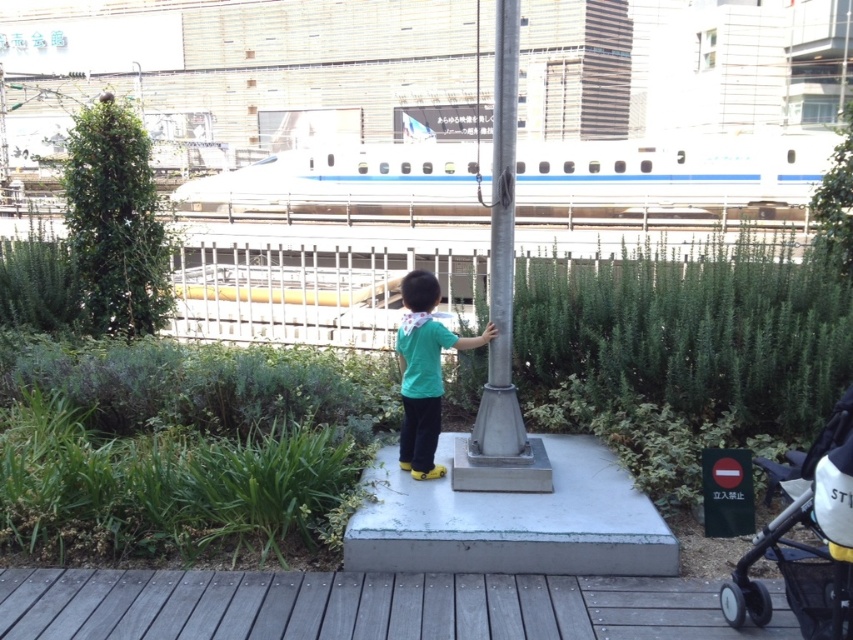
Question: Based on their relative distances, which object is farther from the green matte shirt at center?

Choices:
 (A) white glossy train at upper center
 (B) white plastic baby carriage at lower right
 (C) metallic gray pole at center

Answer: (A)

Question: Is white glossy train at upper center behind metallic gray pole at center?

Choices:
 (A) yes
 (B) no

Answer: (A)

Question: Does white glossy train at upper center appear under white plastic baby carriage at lower right?

Choices:
 (A) no
 (B) yes

Answer: (A)

Question: Which point is farther to the camera?

Choices:
 (A) green matte shirt at center
 (B) white glossy train at upper center

Answer: (A)

Question: Estimate the real-world distances between objects in this image. Which object is farther from the white plastic baby carriage at lower right?

Choices:
 (A) metallic gray pole at center
 (B) green matte shirt at center

Answer: (B)

Question: Is the position of white plastic baby carriage at lower right more distant than that of green matte shirt at center?

Choices:
 (A) yes
 (B) no

Answer: (B)